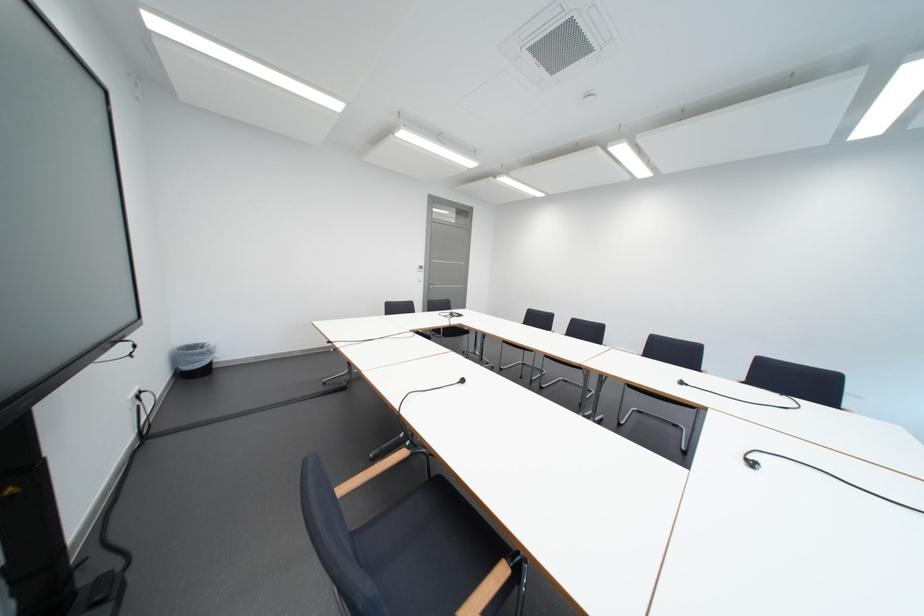
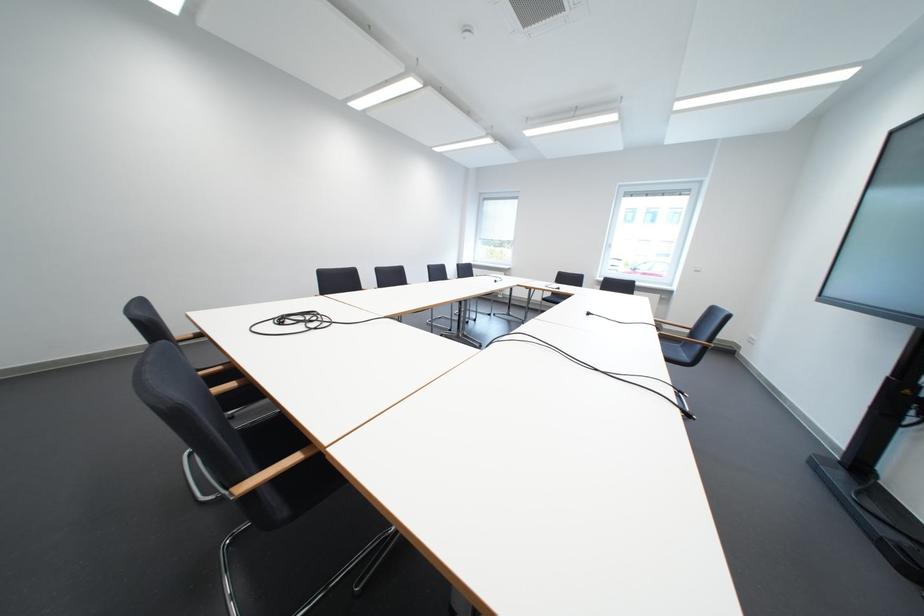
Locate, in the second image, the point that corresponds to pixel 475 383 in the first image.

(601, 315)